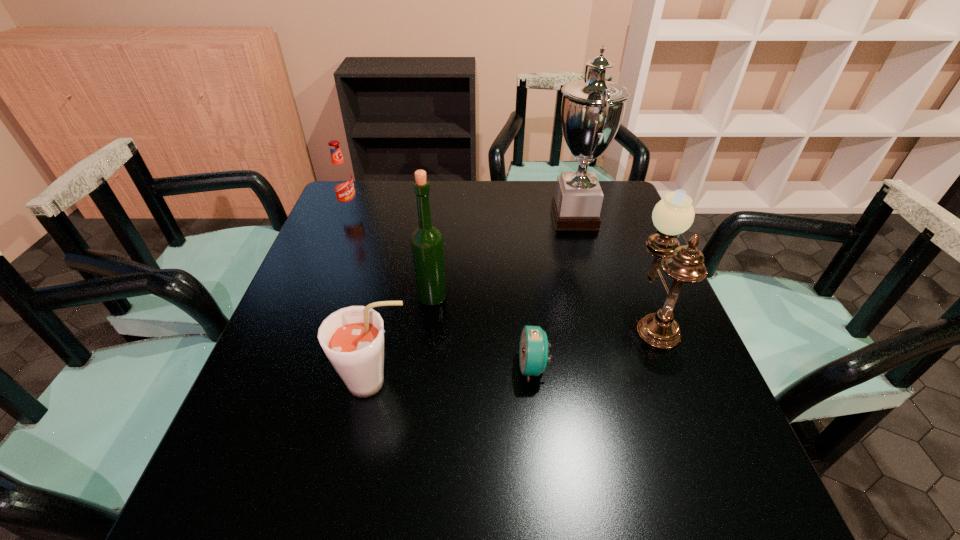
Locate an element on the screen. Image resolution: width=960 pixels, height=540 pixels. object located in the left edge section of the desktop is located at coordinates (341, 177).

At what (x,y) coordinates should I click in order to perform the action: click on trophy cup positioned at the right edge. Please return your answer as a coordinate pair (x, y). Looking at the image, I should click on (592, 110).

Where is `oil lamp that is at the right edge`? This screenshot has height=540, width=960. oil lamp that is at the right edge is located at coordinates (673, 215).

At what (x,y) coordinates should I click in order to perform the action: click on object at the far left corner. Please return your answer as a coordinate pair (x, y). The image size is (960, 540). Looking at the image, I should click on (341, 177).

The image size is (960, 540). In order to click on object that is positioned at the far right corner in this screenshot , I will do `click(592, 110)`.

Where is `vacant space at the far edge of the desktop`? The height and width of the screenshot is (540, 960). vacant space at the far edge of the desktop is located at coordinates (449, 192).

Locate an element on the screen. vacant region at the near edge of the desktop is located at coordinates (444, 515).

Locate an element on the screen. The image size is (960, 540). vacant area at the left edge of the desktop is located at coordinates (325, 314).

Image resolution: width=960 pixels, height=540 pixels. In the image, there is a desktop. Find the location of `free space at the right edge`. free space at the right edge is located at coordinates (602, 232).

I want to click on vacant space at the far left corner of the desktop, so click(367, 205).